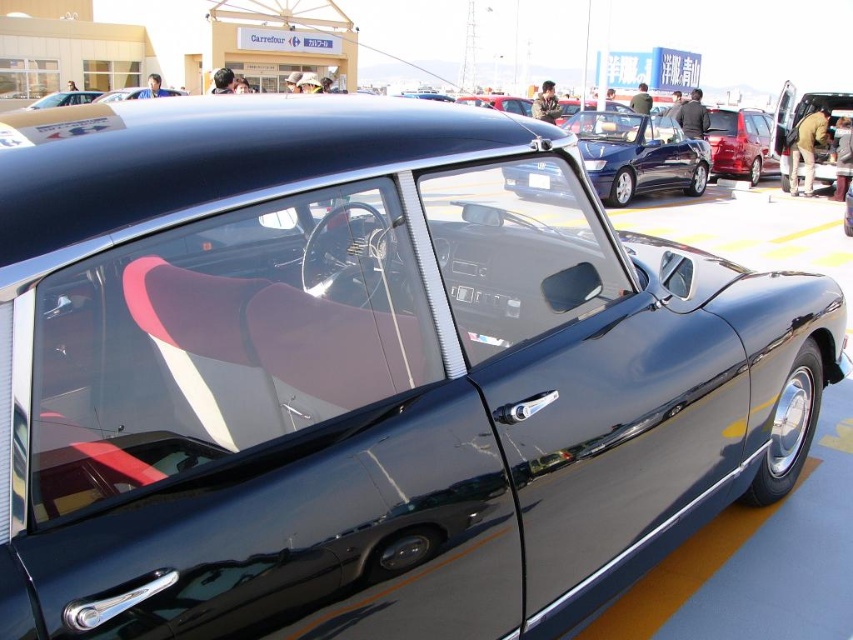
You are standing at the center of the car show venue and want to locate the matte black car at upper left. According to the coordinates provided, what are the exact coordinates where you should look to find it?

The exact coordinates to find the matte black car at upper left are at point (64, 99).

You are a photographer positioned at the origin point of the coordinate system. You want to take a photo of the glossy black sedan at center. What are the coordinates where you should aim your camera?

The coordinates to aim your camera are at point [637,156] to capture the glossy black sedan at center.